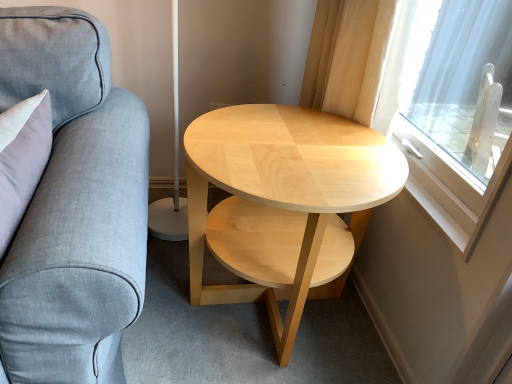
Question: From a real-world perspective, is natural wood coffee table at center physically located above or below transparent glass window at right?

Choices:
 (A) above
 (B) below

Answer: (B)

Question: Considering the positions of natural wood coffee table at center and transparent glass window at right in the image, is natural wood coffee table at center bigger or smaller than transparent glass window at right?

Choices:
 (A) big
 (B) small

Answer: (A)

Question: Estimate the real-world distances between objects in this image. Which object is farther from the transparent glass window at right?

Choices:
 (A) gray fabric couch at left
 (B) natural wood coffee table at center

Answer: (A)

Question: Estimate the real-world distances between objects in this image. Which object is closer to the gray fabric couch at left?

Choices:
 (A) transparent glass window at right
 (B) natural wood coffee table at center

Answer: (B)